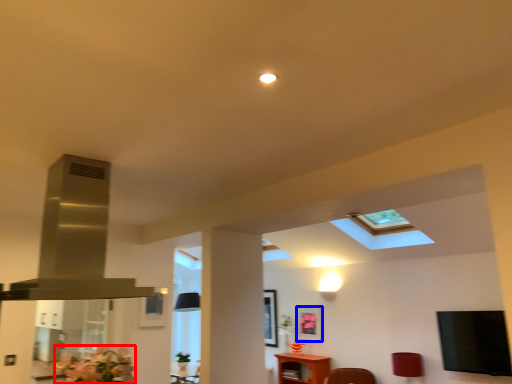
Question: Among these objects, which one is farthest to the camera, flower (highlighted by a red box) or picture frame (highlighted by a blue box)?

Choices:
 (A) flower
 (B) picture frame

Answer: (B)